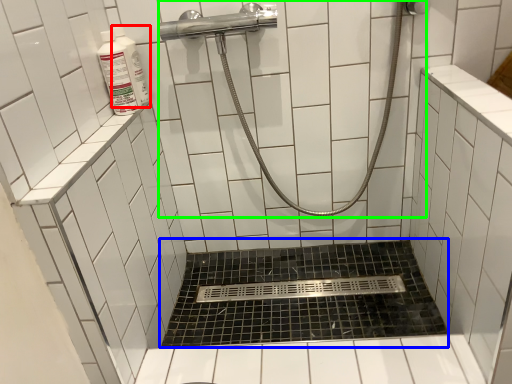
Question: Estimate the real-world distances between objects in this image. Which object is closer to cleaning product (highlighted by a red box), bath (highlighted by a blue box) or shower (highlighted by a green box)?

Choices:
 (A) bath
 (B) shower

Answer: (B)